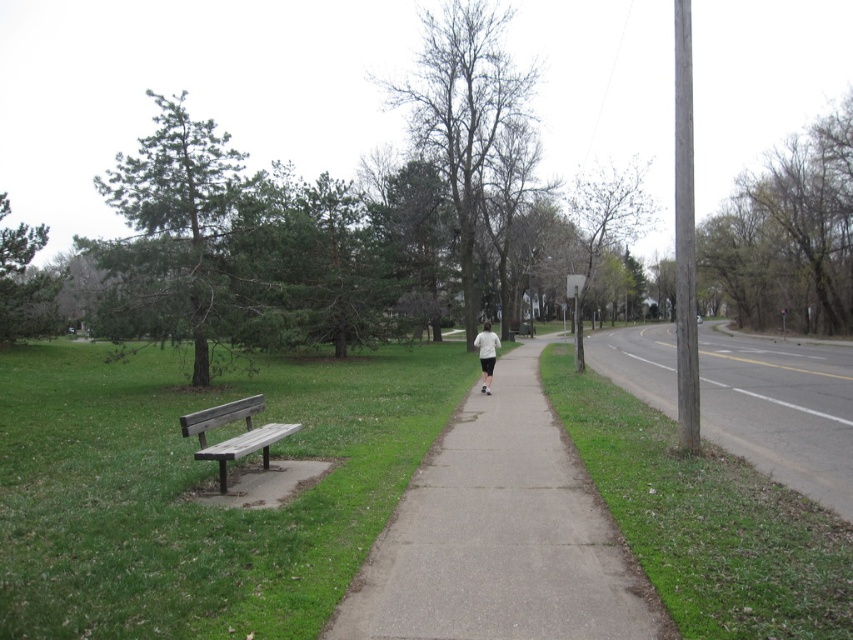
You are standing at the wooden bench on the grass and want to take a photo of the person jogging on the sidewalk. Which point, point (796, 376) or point (253, 397), is closer to your camera lens?

Point (253, 397) is closer to the camera lens because it is positioned nearer to the viewer compared to point (796, 376), which is further away.